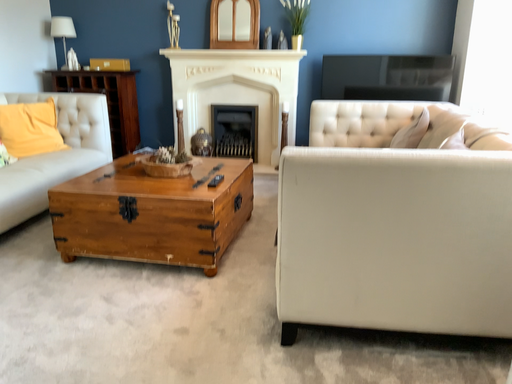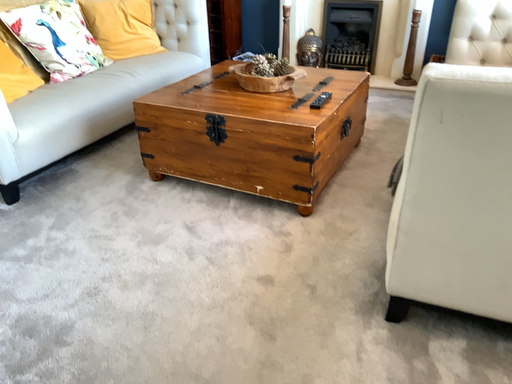
Question: How did the camera likely rotate when shooting the video?

Choices:
 (A) rotated left
 (B) rotated right

Answer: (A)